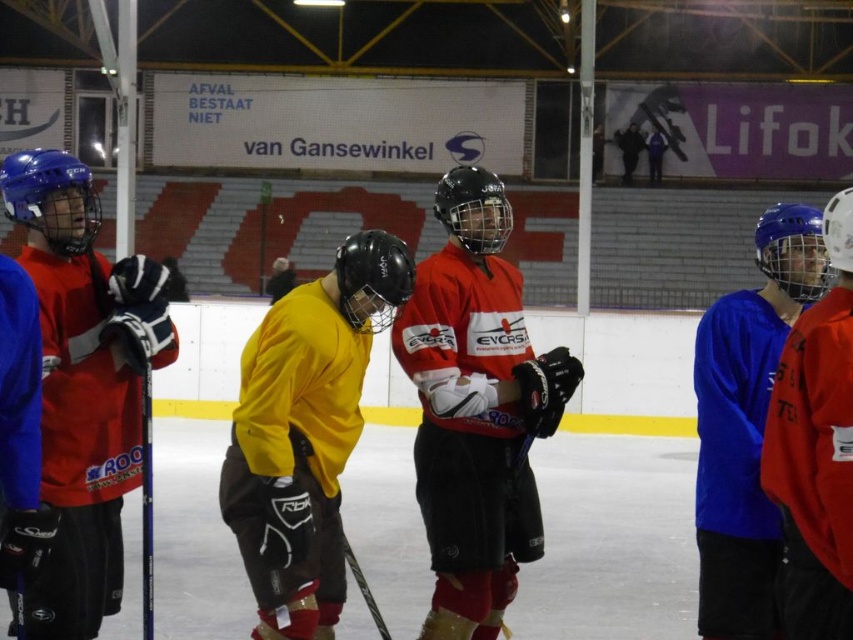
Question: Among these points, which one is farthest from the camera?

Choices:
 (A) (33, 480)
 (B) (317, 401)
 (C) (808, 349)

Answer: (B)

Question: Which object appears closest to the camera in this image?

Choices:
 (A) black matte jacket at upper center
 (B) blue matte helmet at upper right
 (C) matte blue helmet at upper right
 (D) yellow matte jersey at center

Answer: (C)

Question: Which point is closer to the camera?

Choices:
 (A) matte blue helmet at upper right
 (B) matte blue helmet at left
 (C) dark blue jersey at upper center

Answer: (A)

Question: Can you confirm if matte red hockey jersey at center is bigger than blue matte helmet at upper right?

Choices:
 (A) yes
 (B) no

Answer: (A)

Question: Considering the relative positions of matte blue helmet at left and dark blue jersey at upper center in the image provided, where is matte blue helmet at left located with respect to dark blue jersey at upper center?

Choices:
 (A) left
 (B) right

Answer: (A)

Question: Can you confirm if matte blue helmet at left is thinner than black matte jacket at upper center?

Choices:
 (A) no
 (B) yes

Answer: (B)